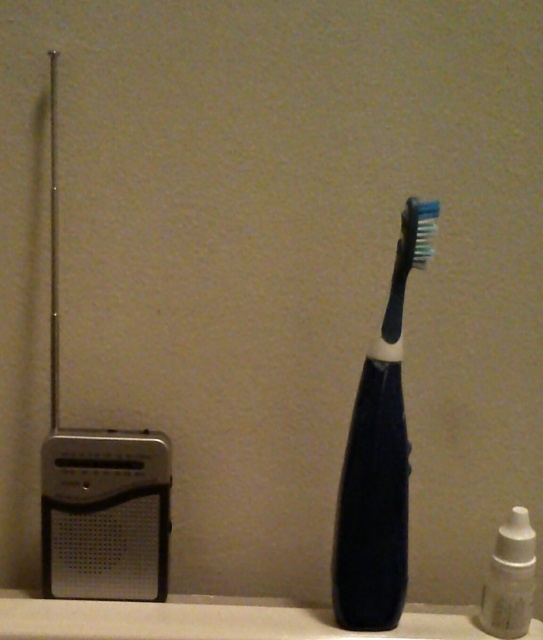
Between black rubberized toothbrush at center and white plastic bottle at lower right, which one appears on the right side from the viewer's perspective?

Positioned to the right is white plastic bottle at lower right.

Image resolution: width=543 pixels, height=640 pixels. Describe the element at coordinates (378, 460) in the screenshot. I see `black rubberized toothbrush at center` at that location.

Where is `black rubberized toothbrush at center`? Image resolution: width=543 pixels, height=640 pixels. black rubberized toothbrush at center is located at coordinates (378, 460).